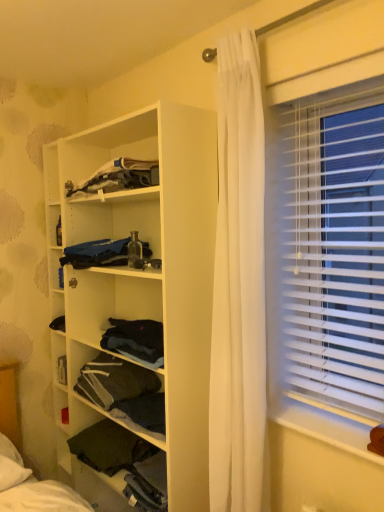
Describe the element at coordinates (327, 247) in the screenshot. The image size is (384, 512). I see `white plastic blinds at right` at that location.

Based on the photo, measure the distance between white plastic window sill at lower right and camera.

A distance of 1.25 meters exists between white plastic window sill at lower right and camera.

The image size is (384, 512). In order to click on white matte wooden shelf at center, which appears as the 3th shelf when ordered from the bottom in this screenshot , I will do (143, 273).

In the scene shown: Can you confirm if white plastic blinds at right is shorter than dark fabric at center, placed as the second shelf when sorted from bottom to top?

No, white plastic blinds at right is not shorter than dark fabric at center, placed as the second shelf when sorted from bottom to top.

Identify the location of window blind above the dark fabric at center, placed as the second shelf when sorted from bottom to top (from the image's perspective). The image size is (384, 512). (327, 247).

Is white plastic blinds at right facing towards dark fabric at center, placed as the second shelf when sorted from bottom to top?

No, white plastic blinds at right is not facing towards dark fabric at center, placed as the second shelf when sorted from bottom to top.

Can you confirm if white plastic blinds at right is thinner than dark fabric at center, acting as the second shelf starting from the top?

Yes.

The width and height of the screenshot is (384, 512). There is a dark gray fabric at upper center, the 1th clothing when ordered from top to bottom. Find the location of `the 1st shelf below it (from the image's perspective)`. the 1st shelf below it (from the image's perspective) is located at coordinates (143, 273).

Is dark gray fabric at upper center, the second clothing from the bottom, not inside white matte wooden shelf at center, which is the 1th shelf from top to bottom?

No.

Considering the relative sizes of dark gray fabric at upper center, the second clothing from the bottom, and white matte wooden shelf at center, which is the 1th shelf from top to bottom, in the image provided, is dark gray fabric at upper center, the second clothing from the bottom, taller than white matte wooden shelf at center, which is the 1th shelf from top to bottom,?

Incorrect, the height of dark gray fabric at upper center, the second clothing from the bottom, is not larger of that of white matte wooden shelf at center, which is the 1th shelf from top to bottom.

Is point (108, 179) positioned in front of point (69, 153)?

Yes, it is.

Considering the sizes of dark fabric at lower left, which ranks as the 3th shelf in top-to-bottom order, and white plastic blinds at right in the image, is dark fabric at lower left, which ranks as the 3th shelf in top-to-bottom order, bigger or smaller than white plastic blinds at right?

Clearly, dark fabric at lower left, which ranks as the 3th shelf in top-to-bottom order, is smaller in size than white plastic blinds at right.

The height and width of the screenshot is (512, 384). I want to click on the 3rd shelf located beneath the white plastic blinds at right (from a real-world perspective), so click(x=125, y=462).

From the image's perspective, is dark fabric at lower left, the first shelf from the bottom, beneath white plastic blinds at right?

Yes, from the image's perspective, dark fabric at lower left, the first shelf from the bottom, is below white plastic blinds at right.

Measure the distance between dark fabric at center, acting as the second shelf starting from the top, and blue fabric at center, marked as the 1th clothing in a bottom-to-top arrangement.

They are 21.87 inches apart.

From the picture: In terms of size, does dark fabric at center, placed as the second shelf when sorted from bottom to top, appear bigger or smaller than blue fabric at center, the 2th clothing in the top-to-bottom sequence?

Considering their sizes, dark fabric at center, placed as the second shelf when sorted from bottom to top, takes up more space than blue fabric at center, the 2th clothing in the top-to-bottom sequence.

From a real-world perspective, who is located lower, dark fabric at center, placed as the second shelf when sorted from bottom to top, or blue fabric at center, the 2th clothing in the top-to-bottom sequence?

dark fabric at center, placed as the second shelf when sorted from bottom to top.

Can you tell me how much dark fabric at center, acting as the second shelf starting from the top, and blue fabric at center, marked as the 1th clothing in a bottom-to-top arrangement, differ in facing direction?

The facing directions of dark fabric at center, acting as the second shelf starting from the top, and blue fabric at center, marked as the 1th clothing in a bottom-to-top arrangement, are 0.38 degrees apart.

Looking at this image, does white plastic window sill at lower right touch dark fabric at lower left, which ranks as the 3th shelf in top-to-bottom order?

No, white plastic window sill at lower right is not next to dark fabric at lower left, which ranks as the 3th shelf in top-to-bottom order.

Is white plastic window sill at lower right surrounding dark fabric at lower left, which ranks as the 3th shelf in top-to-bottom order?

No, dark fabric at lower left, which ranks as the 3th shelf in top-to-bottom order, is not inside white plastic window sill at lower right.

Between white plastic window sill at lower right and dark fabric at lower left, which ranks as the 3th shelf in top-to-bottom order, which one has larger size?

With larger size is dark fabric at lower left, which ranks as the 3th shelf in top-to-bottom order.

Consider the image. How different are the orientations of white plastic window sill at lower right and dark fabric at lower left, the first shelf from the bottom, in degrees?

1.6 degrees.

From a real-world perspective, is dark gray fabric at upper center, the second clothing from the bottom, beneath white plastic window sill at lower right?

No, from a real-world perspective, dark gray fabric at upper center, the second clothing from the bottom, is not below white plastic window sill at lower right.

Considering the relative sizes of dark gray fabric at upper center, the 1th clothing when ordered from top to bottom, and white plastic window sill at lower right in the image provided, is dark gray fabric at upper center, the 1th clothing when ordered from top to bottom, bigger than white plastic window sill at lower right?

Yes, dark gray fabric at upper center, the 1th clothing when ordered from top to bottom, is bigger than white plastic window sill at lower right.

Is dark gray fabric at upper center, the 1th clothing when ordered from top to bottom, to the right of white plastic window sill at lower right from the viewer's perspective?

Incorrect, dark gray fabric at upper center, the 1th clothing when ordered from top to bottom, is not on the right side of white plastic window sill at lower right.

How far apart are dark gray fabric at upper center, the second clothing from the bottom, and white plastic window sill at lower right?

3.51 feet.

Would you say white matte wooden shelf at center, which appears as the 3th shelf when ordered from the bottom, contains dark fabric at lower left, which ranks as the 3th shelf in top-to-bottom order?

Yes, dark fabric at lower left, which ranks as the 3th shelf in top-to-bottom order, is a part of white matte wooden shelf at center, which appears as the 3th shelf when ordered from the bottom.

Does white matte wooden shelf at center, which is the 1th shelf from top to bottom, have a smaller size compared to dark fabric at lower left, which ranks as the 3th shelf in top-to-bottom order?

Incorrect, white matte wooden shelf at center, which is the 1th shelf from top to bottom, is not smaller in size than dark fabric at lower left, which ranks as the 3th shelf in top-to-bottom order.

From their relative heights in the image, would you say white matte wooden shelf at center, which appears as the 3th shelf when ordered from the bottom, is taller or shorter than dark fabric at lower left, the first shelf from the bottom?

In the image, white matte wooden shelf at center, which appears as the 3th shelf when ordered from the bottom, appears to be taller than dark fabric at lower left, the first shelf from the bottom.

From the image's perspective, which one is positioned higher, white matte wooden shelf at center, which appears as the 3th shelf when ordered from the bottom, or dark fabric at lower left, which ranks as the 3th shelf in top-to-bottom order?

white matte wooden shelf at center, which appears as the 3th shelf when ordered from the bottom, is shown above in the image.

Locate an element on the screen. This screenshot has height=512, width=384. the 2nd shelf below when counting from the white plastic blinds at right (from the image's perspective) is located at coordinates (125, 392).

Locate an element on the screen. The image size is (384, 512). the 1st clothing behind the white matte wooden shelf at center, which is the 1th shelf from top to bottom is located at coordinates coord(118,177).

From the image, which object appears to be farther from dark fabric at lower left, which ranks as the 3th shelf in top-to-bottom order, dark fabric at center, placed as the second shelf when sorted from bottom to top, or white plastic blinds at right?

Among the two, white plastic blinds at right is located further to dark fabric at lower left, which ranks as the 3th shelf in top-to-bottom order.

Considering their positions, is dark gray fabric at upper center, the 1th clothing when ordered from top to bottom, positioned further to white matte wooden shelf at center, which is the 1th shelf from top to bottom, than dark fabric at center, placed as the second shelf when sorted from bottom to top?

Based on the image, dark fabric at center, placed as the second shelf when sorted from bottom to top, appears to be further to white matte wooden shelf at center, which is the 1th shelf from top to bottom.

Looking at the image, which one is located further to dark fabric at center, placed as the second shelf when sorted from bottom to top, blue fabric at center, the 2th clothing in the top-to-bottom sequence, or white plastic blinds at right?

The object further to dark fabric at center, placed as the second shelf when sorted from bottom to top, is white plastic blinds at right.

When comparing their distances from white matte wooden shelf at center, which is the 1th shelf from top to bottom, does white plastic window sill at lower right or blue fabric at center, marked as the 1th clothing in a bottom-to-top arrangement, seem further?

white plastic window sill at lower right.

Which object lies further to the anchor point white plastic window sill at lower right, dark gray fabric at upper center, the 1th clothing when ordered from top to bottom, or dark fabric at lower left, which ranks as the 3th shelf in top-to-bottom order?

dark gray fabric at upper center, the 1th clothing when ordered from top to bottom.

Estimate the real-world distances between objects in this image. Which object is further from dark fabric at center, placed as the second shelf when sorted from bottom to top, blue fabric at center, the 2th clothing in the top-to-bottom sequence, or white matte wooden shelf at center, which is the 1th shelf from top to bottom?

blue fabric at center, the 2th clothing in the top-to-bottom sequence, is further to dark fabric at center, placed as the second shelf when sorted from bottom to top.

From the image, which object appears to be farther from white matte wooden shelf at center, which appears as the 3th shelf when ordered from the bottom, white plastic blinds at right or dark gray fabric at upper center, the 1th clothing when ordered from top to bottom?

white plastic blinds at right.

From the image, which object appears to be farther from dark fabric at center, placed as the second shelf when sorted from bottom to top, white matte wooden shelf at center, which appears as the 3th shelf when ordered from the bottom, or dark gray fabric at upper center, the second clothing from the bottom?

→ dark gray fabric at upper center, the second clothing from the bottom, is further to dark fabric at center, placed as the second shelf when sorted from bottom to top.

Where is `clothing between dark gray fabric at upper center, the 1th clothing when ordered from top to bottom, and dark fabric at center, acting as the second shelf starting from the top, in the up-down direction`? The width and height of the screenshot is (384, 512). clothing between dark gray fabric at upper center, the 1th clothing when ordered from top to bottom, and dark fabric at center, acting as the second shelf starting from the top, in the up-down direction is located at coordinates (97, 254).

This screenshot has height=512, width=384. Find the location of `window blind located between dark fabric at center, placed as the second shelf when sorted from bottom to top, and white plastic window sill at lower right in the left-right direction`. window blind located between dark fabric at center, placed as the second shelf when sorted from bottom to top, and white plastic window sill at lower right in the left-right direction is located at coordinates (327, 247).

Identify the location of window blind between dark fabric at lower left, the first shelf from the bottom, and white plastic window sill at lower right, in the horizontal direction. (327, 247).

The image size is (384, 512). I want to click on shelf between blue fabric at center, marked as the 1th clothing in a bottom-to-top arrangement, and dark fabric at center, acting as the second shelf starting from the top, in the up-down direction, so click(x=143, y=273).